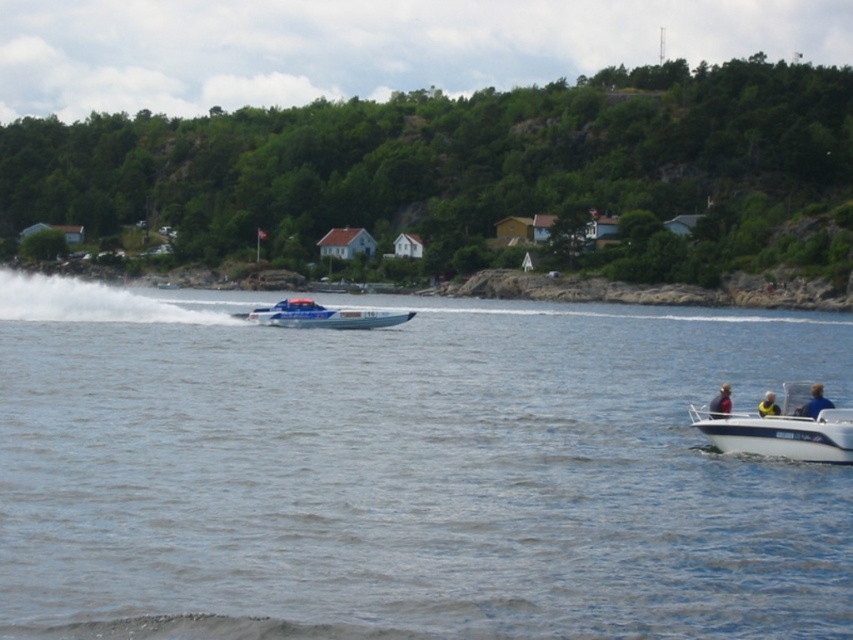
You are standing on the dock and see the white plastic boat at lower right. If you want to throw a lifebuoy to it, and the lifebuoy can reach up to 75 feet, will it be possible?

The white plastic boat at lower right is 74.26 feet away from viewer, so yes, the lifebuoy can reach it since it is within the 75 feet range.

You are a safety inspector checking the placement of safety equipment on the yellow life vest at lower right and the blue fabric jacket at lower right. According to the safety guidelines, the life vest must be easily accessible and not covered by other items. Is the current arrangement compliant?

The blue fabric jacket at lower right is located above the yellow life vest at lower right, which means the jacket is covering the life vest. This violates the safety guideline requiring the life vest to be easily accessible and uncovered. The arrangement is not compliant.

From the picture: You are a safety inspector checking the watercraft in the scene. You notice the white plastic boat at lower right and the yellow life vest at lower right. Which object requires a size check to ensure compliance with safety regulations?

The white plastic boat at lower right requires a size check because it is bigger than the yellow life vest at lower right, and larger vessels typically need to comply with specific size regulations for safety.